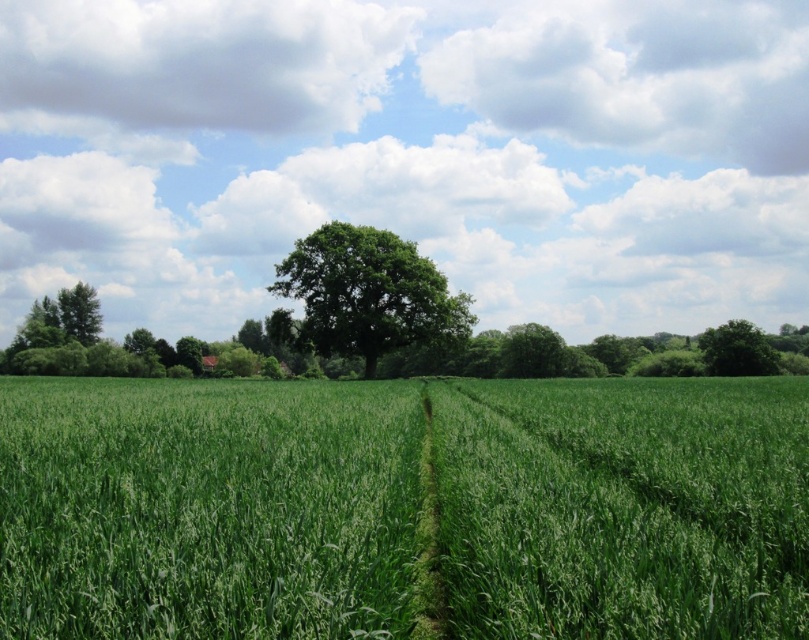
You are a farmer planning to plant new crops in the green grassy wheat field at center and the green leafy tree at right. Considering their sizes, which area would allow for more space to plant additional crops?

The green grassy wheat field at center has a larger width than the green leafy tree at right, so it would allow for more space to plant additional crops.

You are standing at the origin point of the coordinate system in the image. You want to walk to the green grassy wheat field at center. In which direction should you move?

The green grassy wheat field at center is located at coordinate point 0.794 on the x axis and 0.256 on the y axis. Since you are at the origin point, you should move towards the positive x and positive y direction to reach it.